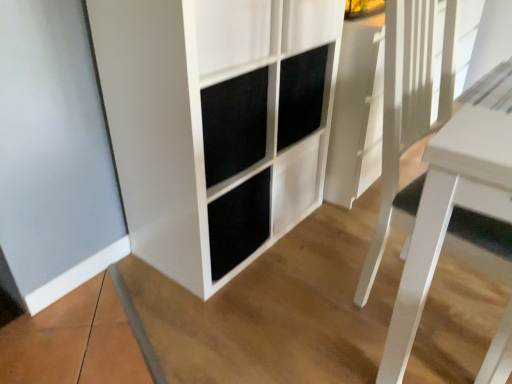
Describe the element at coordinates (216, 124) in the screenshot. I see `white matte cabinet at center` at that location.

This screenshot has height=384, width=512. I want to click on white matte cabinet at center, so click(216, 124).

Where is `white glossy table at right`? This screenshot has height=384, width=512. white glossy table at right is located at coordinates (446, 242).

What do you see at coordinates (446, 242) in the screenshot? I see `white glossy table at right` at bounding box center [446, 242].

Locate an element on the screen. white matte cabinet at center is located at coordinates (216, 124).

Considering the positions of objects white glossy table at right and white matte cabinet at center in the image provided, who is more to the left, white glossy table at right or white matte cabinet at center?

white matte cabinet at center is more to the left.

Is white glossy table at right further to camera compared to white matte cabinet at center?

No, it is in front of white matte cabinet at center.

Considering the points (487, 225) and (215, 25), which point is in front, point (487, 225) or point (215, 25)?

The point (487, 225) is in front.

From the image's perspective, is white glossy table at right beneath white matte cabinet at center?

Yes, from the image's perspective, white glossy table at right is beneath white matte cabinet at center.

Based on the photo, from a real-world perspective, is white glossy table at right below white matte cabinet at center?

Yes, from a real-world perspective, white glossy table at right is under white matte cabinet at center.

Consider the image. Considering the sizes of white glossy table at right and white matte cabinet at center in the image, is white glossy table at right wider or thinner than white matte cabinet at center?

Considering their sizes, white glossy table at right looks slimmer than white matte cabinet at center.

Is white glossy table at right taller than white matte cabinet at center?

No, white glossy table at right is not taller than white matte cabinet at center.

Considering the relative sizes of white glossy table at right and white matte cabinet at center in the image provided, is white glossy table at right smaller than white matte cabinet at center?

Yes, white glossy table at right is smaller than white matte cabinet at center.

Would you say white matte cabinet at center is part of white glossy table at right's contents?

No.

Is there a large distance between white glossy table at right and white matte cabinet at center?

That's not correct — white glossy table at right is a little close to white matte cabinet at center.

Is white glossy table at right facing towards white matte cabinet at center?

No, white glossy table at right is not facing towards white matte cabinet at center.

How many degrees apart are the facing directions of white glossy table at right and white matte cabinet at center?

There is a 0.656-degree angle between the facing directions of white glossy table at right and white matte cabinet at center.

How far apart are white glossy table at right and white matte cabinet at center?

24.99 inches.

You are a GUI agent. You are given a task and a screenshot of the screen. Output one action in this format:
    pyautogui.click(x=<x>, y=<y>)
    Task: Click on the cupboard behind the white glossy table at right
    Image resolution: width=512 pixels, height=384 pixels.
    Given the screenshot: What is the action you would take?
    pyautogui.click(x=216, y=124)

Consider the image. Considering the relative positions of white matte cabinet at center and white glossy table at right in the image provided, is white matte cabinet at center to the right of white glossy table at right from the viewer's perspective?

Incorrect, white matte cabinet at center is not on the right side of white glossy table at right.

Is white matte cabinet at center positioned behind white glossy table at right?

Yes, it is.

Is point (140, 102) positioned behind point (479, 196)?

Yes, point (140, 102) is behind point (479, 196).

From the image's perspective, is white matte cabinet at center located above white glossy table at right?

Yes, from the image's perspective, white matte cabinet at center is on top of white glossy table at right.

From a real-world perspective, is white matte cabinet at center on white glossy table at right?

Yes, from a real-world perspective, white matte cabinet at center is on top of white glossy table at right.

Between white matte cabinet at center and white glossy table at right, which one has larger width?

Wider between the two is white matte cabinet at center.

Considering the sizes of objects white matte cabinet at center and white glossy table at right in the image provided, who is taller, white matte cabinet at center or white glossy table at right?

white matte cabinet at center is taller.

Is white matte cabinet at center smaller than white glossy table at right?

No.

Is white glossy table at right surrounded by white matte cabinet at center?

No, white matte cabinet at center does not contain white glossy table at right.

Is white matte cabinet at center not close to white glossy table at right?

No, white matte cabinet at center is not far away from white glossy table at right.

Is white matte cabinet at center looking in the opposite direction of white glossy table at right?

No, white matte cabinet at center is not facing away from white glossy table at right.

Can you tell me how much white matte cabinet at center and white glossy table at right differ in facing direction?

0.656 degrees.

The image size is (512, 384). Identify the location of table that is under the white matte cabinet at center (from a real-world perspective). (446, 242).

This screenshot has width=512, height=384. What are the coordinates of `table below the white matte cabinet at center (from a real-world perspective)` in the screenshot? It's located at (446, 242).

Identify the location of table in front of the white matte cabinet at center. (446, 242).